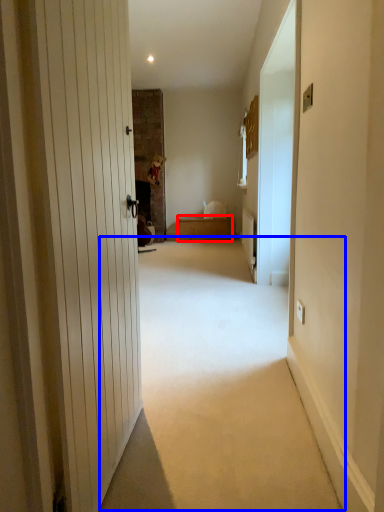
Question: Which point is closer to the camera, furniture (highlighted by a red box) or corridor (highlighted by a blue box)?

Choices:
 (A) furniture
 (B) corridor

Answer: (B)